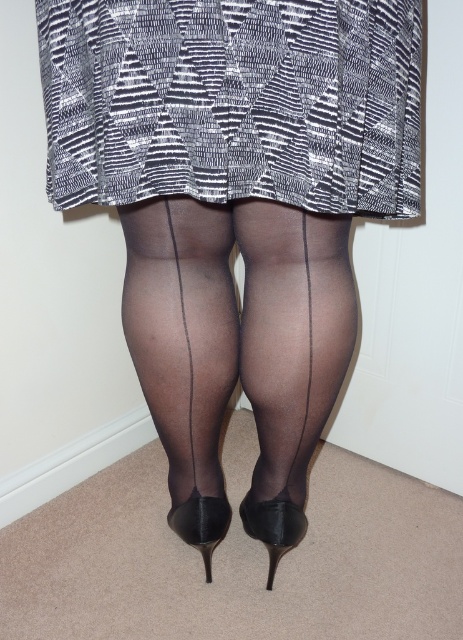
Question: Can you confirm if sheer black tights at center is positioned above black glossy heel at center?

Choices:
 (A) yes
 (B) no

Answer: (A)

Question: Is sheer black tights at center above sheer black stockings at center?

Choices:
 (A) no
 (B) yes

Answer: (A)

Question: Can you confirm if black textured skirt at center is bigger than black glossy heel at center?

Choices:
 (A) yes
 (B) no

Answer: (A)

Question: Which object is farther from the camera taking this photo?

Choices:
 (A) sheer black tights at center
 (B) black leather high-heeled shoe at center
 (C) black glossy heel at center
 (D) sheer black stockings at center

Answer: (C)

Question: Which point appears closest to the camera in this image?

Choices:
 (A) (274, 534)
 (B) (174, 454)

Answer: (B)

Question: Which point is farther from the camera taking this photo?

Choices:
 (A) (345, 248)
 (B) (402, 104)
 (C) (206, 496)
 (D) (291, 531)

Answer: (C)